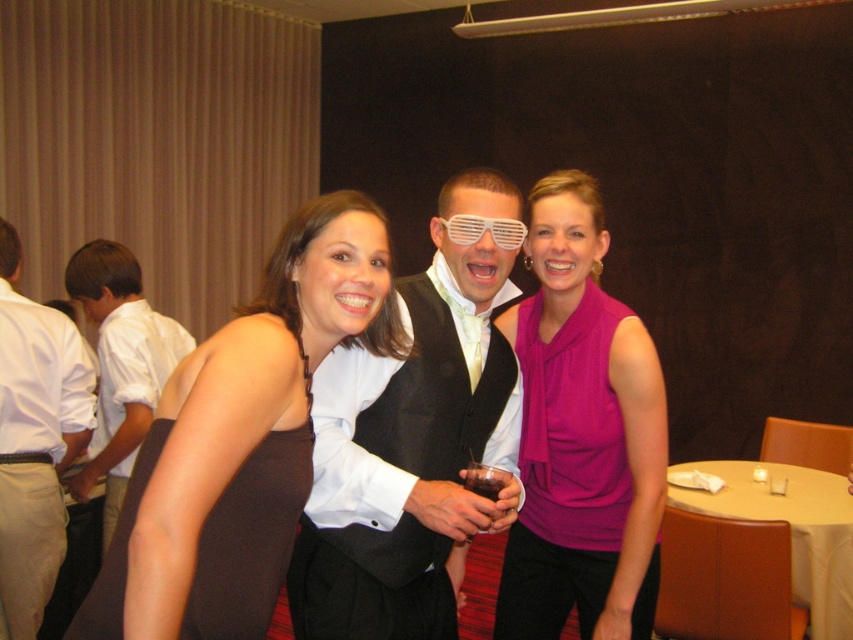
You are a photographer trying to capture a group photo of the purple silky blouse at center and the white shirt at left. Based on their heights, which person should stand in the front row?

The purple silky blouse at center is not as tall as the white shirt at left, so the person wearing the purple silky blouse at center should stand in the front row to ensure both are visible in the photo.

You are at an event and want to take a photo of the white glossy shirt at left and the white plastic goggles at center. Which object should you focus on first if you want to capture both in the same frame without moving the camera?

The white glossy shirt at left is positioned under the white plastic goggles at center, so you should focus on the white plastic goggles at center first to ensure both are in the frame.

You are standing in the room and want to hand a drink to the person wearing the brown satin dress at center without disturbing the person in the white shirt at left. Which direction should you approach from?

You should approach from the right side since the brown satin dress at center is closer to the viewer than the white shirt at left, meaning the dress is positioned in front of the white shirt. This allows you to reach the person in the dress without needing to go around the left side where the other person is located.